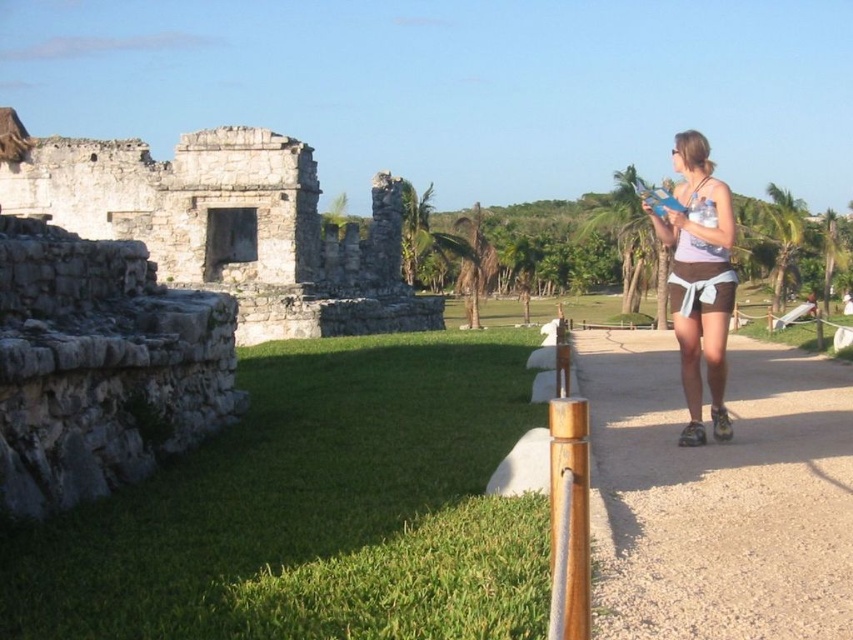
You are an archaeologist planning to walk from the brown gravel path at center to the gray stone ruins at left. Based on their lengths, which one do you think is shorter?

The brown gravel path at center is shorter than the gray stone ruins at left, so the path is shorter.

You are standing at the archaeological site and want to reach a point that is exactly 40 meters away from your current position. Is the point at coordinate (x=619, y=504) within this distance?

The point at coordinate (x=619, y=504) is 41.48 meters away from the viewer, which exceeds the 40 meters distance you desire. Therefore, it is slightly beyond your target range.